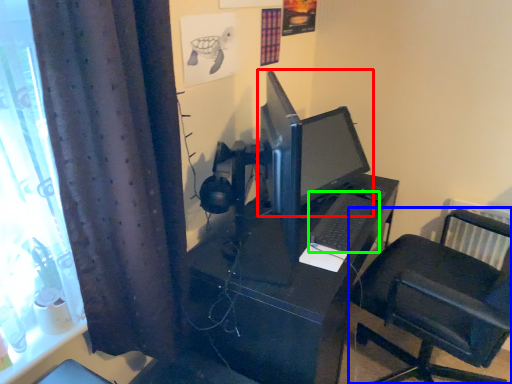
Question: Estimate the real-world distances between objects in this image. Which object is closer to computer monitor (highlighted by a red box), furniture (highlighted by a blue box) or computer keyboard (highlighted by a green box)?

Choices:
 (A) furniture
 (B) computer keyboard

Answer: (B)